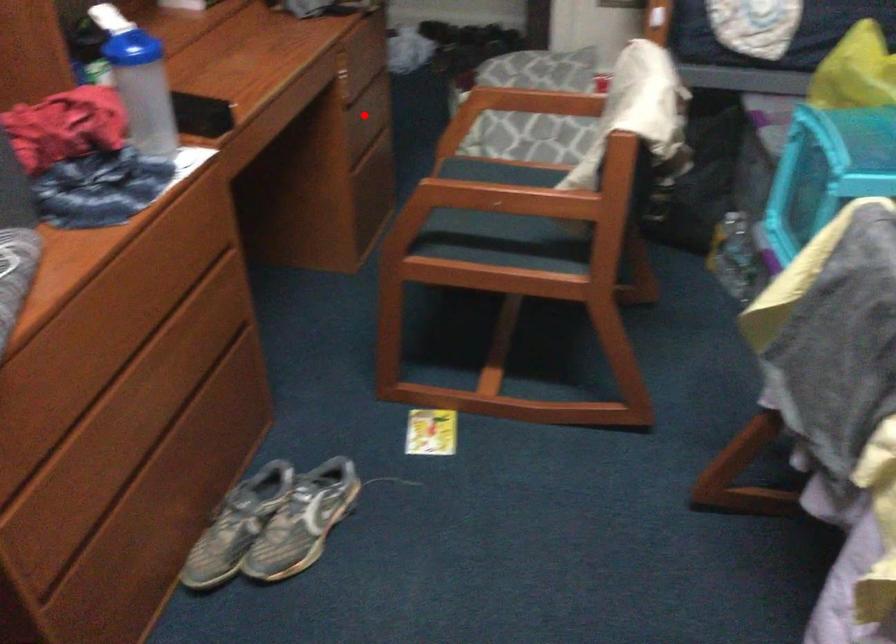
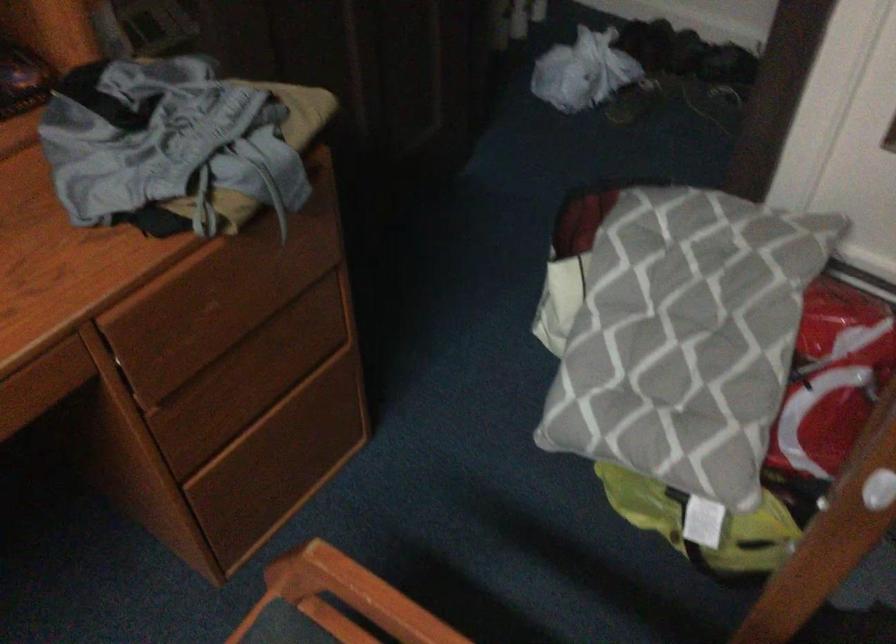
Question: I am providing you with two images of the same scene from different viewpoints. Given a red point in image1, look at the same physical point in image2. Is it:

Choices:
 (A) Closer to the viewpoint
 (B) Farther from the viewpoint

Answer: (A)